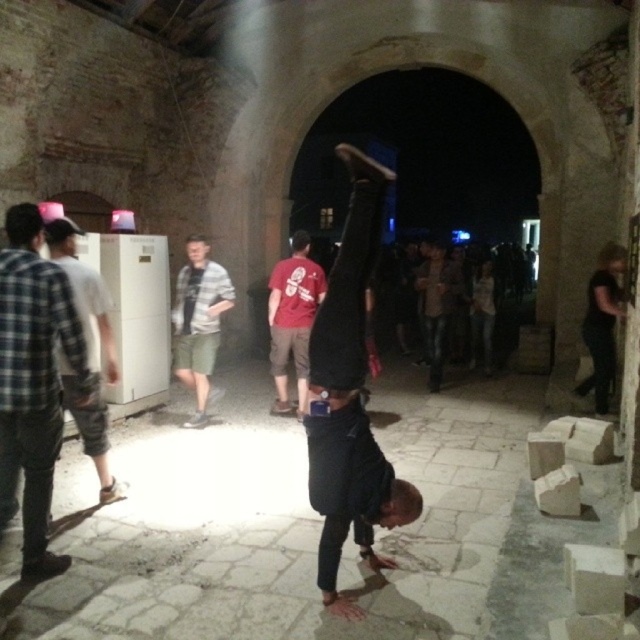
Question: Can you confirm if red cotton t-shirt at center is thinner than brown leather jacket at center?

Choices:
 (A) no
 (B) yes

Answer: (A)

Question: Is plaid shirt at left below brown leather jacket at center?

Choices:
 (A) yes
 (B) no

Answer: (A)

Question: Does plaid shirt at left appear on the right side of red cotton t-shirt at center?

Choices:
 (A) yes
 (B) no

Answer: (B)

Question: Among these objects, which one is nearest to the camera?

Choices:
 (A) brown leather jacket at center
 (B) black matte pants at center
 (C) plaid fabric shirt at left
 (D) black matte shirt at right

Answer: (B)

Question: Considering the real-world distances, which object is closest to the plaid fabric shirt at left?

Choices:
 (A) plaid shirt at left
 (B) brown leather jacket at center
 (C) black matte pants at center

Answer: (A)

Question: Which point is farther to the camera?

Choices:
 (A) brown leather jacket at center
 (B) red cotton t-shirt at center
 (C) black matte pants at center

Answer: (A)